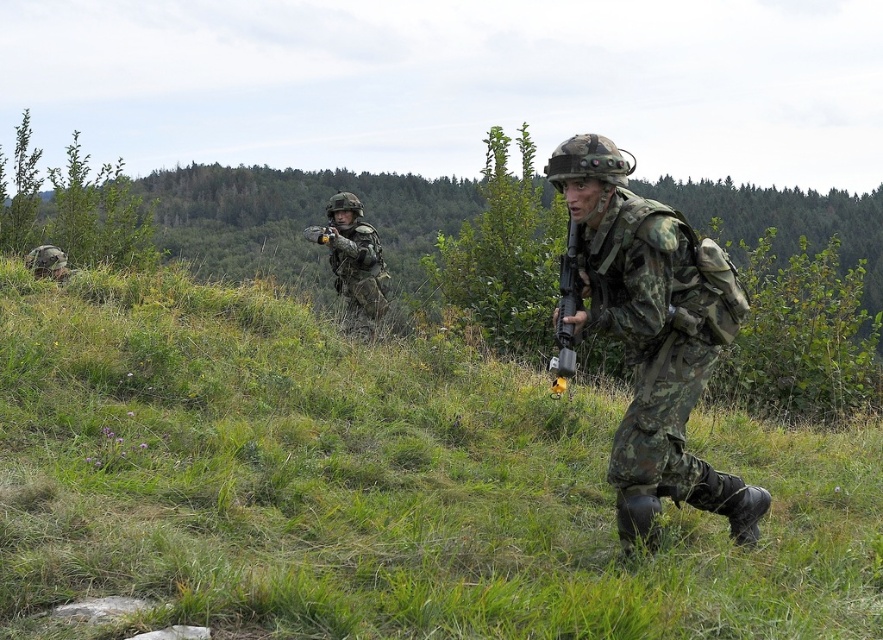
Can you confirm if green grassy at center is positioned above matte black rifle at center?

No, green grassy at center is not above matte black rifle at center.

Can you confirm if green grassy at center is positioned to the left of matte black rifle at center?

Yes, green grassy at center is to the left of matte black rifle at center.

You are a GUI agent. You are given a task and a screenshot of the screen. Output one action in this format:
    pyautogui.click(x=<x>, y=<y>)
    Task: Click on the green grassy at center
    
    Given the screenshot: What is the action you would take?
    pyautogui.click(x=376, y=484)

Locate an element on the screen. The image size is (883, 640). green grassy at center is located at coordinates (376, 484).

Can you confirm if camouflage fabric uniform at center is positioned above camouflage fabric helmet at center?

No, camouflage fabric uniform at center is not above camouflage fabric helmet at center.

Can you confirm if camouflage fabric uniform at center is thinner than camouflage fabric helmet at center?

No.

At what (x,y) coordinates should I click in order to perform the action: click on camouflage fabric uniform at center. Please return your answer as a coordinate pair (x, y). Looking at the image, I should click on (653, 337).

Can you confirm if camouflage fabric helmet at center is smaller than matte black rifle at center?

No, camouflage fabric helmet at center is not smaller than matte black rifle at center.

Between camouflage fabric helmet at center and matte black rifle at center, which one is positioned higher?

camouflage fabric helmet at center is above.

Which is in front, point (348, 330) or point (557, 316)?

Point (557, 316)

I want to click on camouflage fabric helmet at center, so click(353, 260).